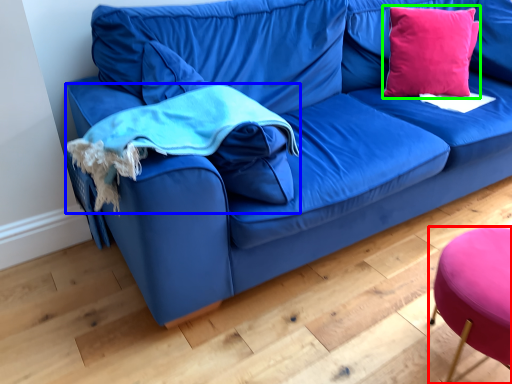
Question: Which object is the closest to the stool (highlighted by a red box)? Choose among these: cloth (highlighted by a blue box) or throw pillow (highlighted by a green box).

Choices:
 (A) cloth
 (B) throw pillow

Answer: (A)